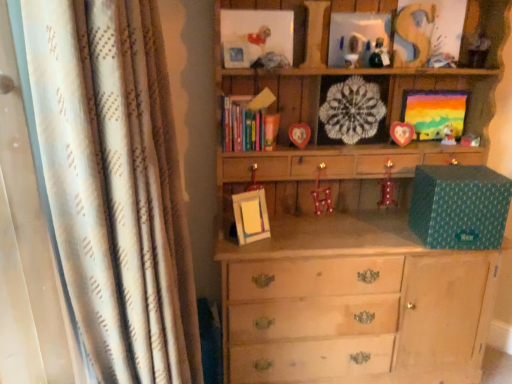
Question: Is wooden toy at upper right, arranged as the second toy when viewed from the right, outside of matte plastic toy at center, arranged as the 5th toy when viewed from the left?

Choices:
 (A) yes
 (B) no

Answer: (A)

Question: Is wooden toy at upper right, which is the 4th toy in left-to-right order, oriented towards matte plastic toy at center, the 1th toy from the bottom?

Choices:
 (A) yes
 (B) no

Answer: (B)

Question: Is matte plastic toy at center, the 1th toy from the bottom, located within wooden toy at upper right, which is counted as the first toy, starting from the top?

Choices:
 (A) no
 (B) yes

Answer: (A)

Question: Considering the relative sizes of wooden toy at upper right, which is counted as the first toy, starting from the top, and matte plastic toy at center, the 5th toy when ordered from top to bottom, in the image provided, is wooden toy at upper right, which is counted as the first toy, starting from the top, shorter than matte plastic toy at center, the 5th toy when ordered from top to bottom,?

Choices:
 (A) no
 (B) yes

Answer: (A)

Question: From a real-world perspective, is wooden toy at upper right, arranged as the second toy when viewed from the right, under matte plastic toy at center, the 1th toy from the bottom?

Choices:
 (A) yes
 (B) no

Answer: (B)

Question: Looking at the image, does wooden heart-shaped frame at center, marked as the 5th picture frame in a right-to-left arrangement, seem bigger or smaller compared to matte white figurine at upper right, acting as the 2th toy starting from the bottom?

Choices:
 (A) small
 (B) big

Answer: (B)

Question: From their relative heights in the image, would you say wooden heart-shaped frame at center, which appears as the 4th picture frame when viewed from the left, is taller or shorter than matte white figurine at upper right, which is counted as the 3th toy, starting from the left?

Choices:
 (A) short
 (B) tall

Answer: (B)

Question: In the image, is wooden heart-shaped frame at center, marked as the 5th picture frame in a right-to-left arrangement, positioned in front of or behind matte white figurine at upper right, which is the 3th toy from right to left?

Choices:
 (A) behind
 (B) front

Answer: (B)

Question: Is wooden heart-shaped frame at center, which appears as the 4th picture frame when viewed from the left, wider or thinner than matte white figurine at upper right, acting as the 2th toy starting from the bottom?

Choices:
 (A) wide
 (B) thin

Answer: (A)

Question: In the image, is matte wooden picture frame at upper center, placed as the 3th picture frame when sorted from right to left, positioned in front of or behind white lace doily at upper center, the 5th picture frame positioned from the left?

Choices:
 (A) behind
 (B) front

Answer: (B)

Question: From a real-world perspective, is matte wooden picture frame at upper center, placed as the 3th picture frame when sorted from right to left, above or below white lace doily at upper center, the 5th picture frame positioned from the left?

Choices:
 (A) below
 (B) above

Answer: (B)

Question: In terms of size, does matte wooden picture frame at upper center, which appears as the sixth picture frame when viewed from the left, appear bigger or smaller than white lace doily at upper center, the fourth picture frame positioned from the right?

Choices:
 (A) big
 (B) small

Answer: (B)

Question: Is matte wooden picture frame at upper center, which appears as the sixth picture frame when viewed from the left, inside or outside of white lace doily at upper center, the fourth picture frame positioned from the right?

Choices:
 (A) inside
 (B) outside

Answer: (B)

Question: Considering the positions of metallic silver picture frame at upper center, the first picture frame from the left, and matte wooden picture frame at upper center, placed as the 3th picture frame when sorted from right to left, in the image, is metallic silver picture frame at upper center, the first picture frame from the left, taller or shorter than matte wooden picture frame at upper center, placed as the 3th picture frame when sorted from right to left,?

Choices:
 (A) short
 (B) tall

Answer: (A)

Question: Considering the positions of metallic silver picture frame at upper center, the first picture frame from the left, and matte wooden picture frame at upper center, which appears as the sixth picture frame when viewed from the left, in the image, is metallic silver picture frame at upper center, the first picture frame from the left, wider or thinner than matte wooden picture frame at upper center, which appears as the sixth picture frame when viewed from the left,?

Choices:
 (A) wide
 (B) thin

Answer: (A)